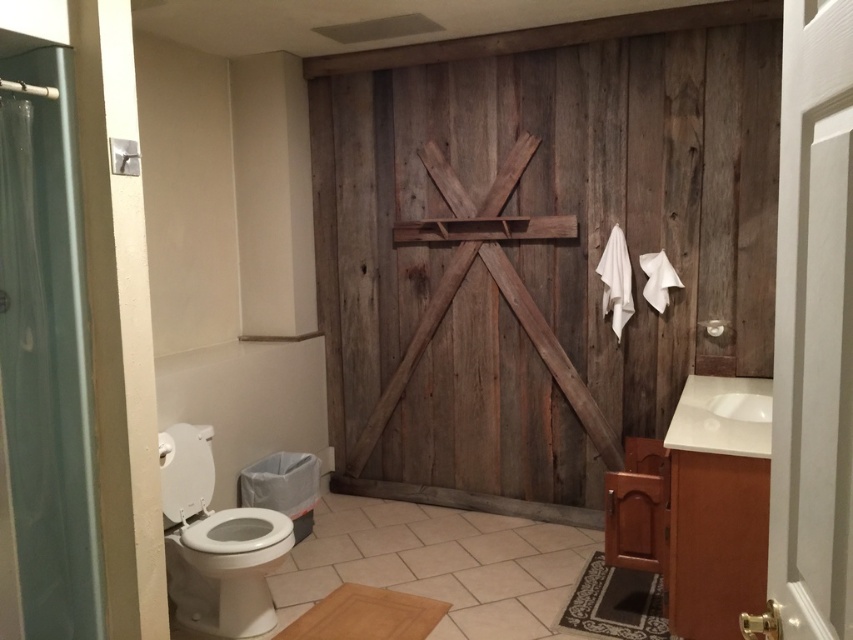
Question: Can you confirm if clear plastic shower curtain at left is bigger than white glossy sink at right?

Choices:
 (A) no
 (B) yes

Answer: (A)

Question: Considering the relative positions of weathered wood barn door at center and white glossy toilet bowl at lower left in the image provided, where is weathered wood barn door at center located with respect to white glossy toilet bowl at lower left?

Choices:
 (A) above
 (B) below

Answer: (A)

Question: Estimate the real-world distances between objects in this image. Which object is closer to the white glossy sink at right?

Choices:
 (A) weathered wood barn door at center
 (B) clear plastic shower curtain at left

Answer: (A)

Question: Is the position of weathered wood barn door at center less distant than that of clear plastic shower curtain at left?

Choices:
 (A) no
 (B) yes

Answer: (A)

Question: Which point is closer to the camera?

Choices:
 (A) (653, 45)
 (B) (766, 378)
 (C) (257, 620)
 (D) (62, 186)

Answer: (D)

Question: Considering the real-world distances, which object is farthest from the clear plastic shower curtain at left?

Choices:
 (A) white glossy sink at right
 (B) weathered wood barn door at center

Answer: (B)